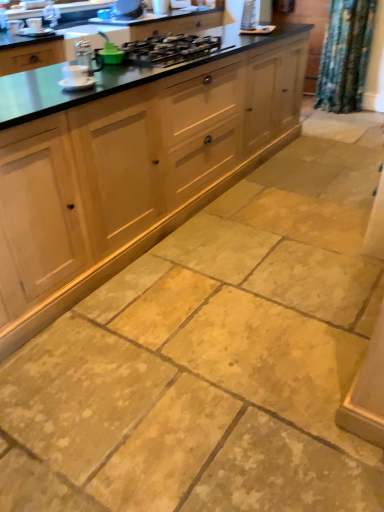
Question: Is matte white cup at upper left, which is the third appliance in front-to-back order, taller or shorter than natural wood cabinets at center?

Choices:
 (A) tall
 (B) short

Answer: (B)

Question: Would you say matte white cup at upper left, which is the 1th appliance in left-to-right order, is to the left or to the right of natural wood cabinets at center in the picture?

Choices:
 (A) left
 (B) right

Answer: (A)

Question: Based on their relative distances, which object is nearer to the white ceramic cup at upper left, which appears as the 1th appliance when ordered from the bottom?

Choices:
 (A) green plastic brush at upper center, acting as the 2th appliance starting from the bottom
 (B) metallic silver kettle at upper center, the 4th appliance when ordered from front to back
 (C) natural wood cabinets at center
 (D) matte white cup at upper left, which is the third appliance in front-to-back order
 (E) metallic black gas stove at center

Answer: (A)

Question: Which is nearer to the natural wood cabinets at center?

Choices:
 (A) green plastic brush at upper center, the 2th appliance when ordered from front to back
 (B) white ceramic cup at upper left, the 1th appliance viewed from the front
 (C) metallic black gas stove at center
 (D) white glossy mug at upper center, which is the fifth appliance in front-to-back order
 (E) metallic silver kettle at upper center, the fourth appliance in the right-to-left sequence

Answer: (C)